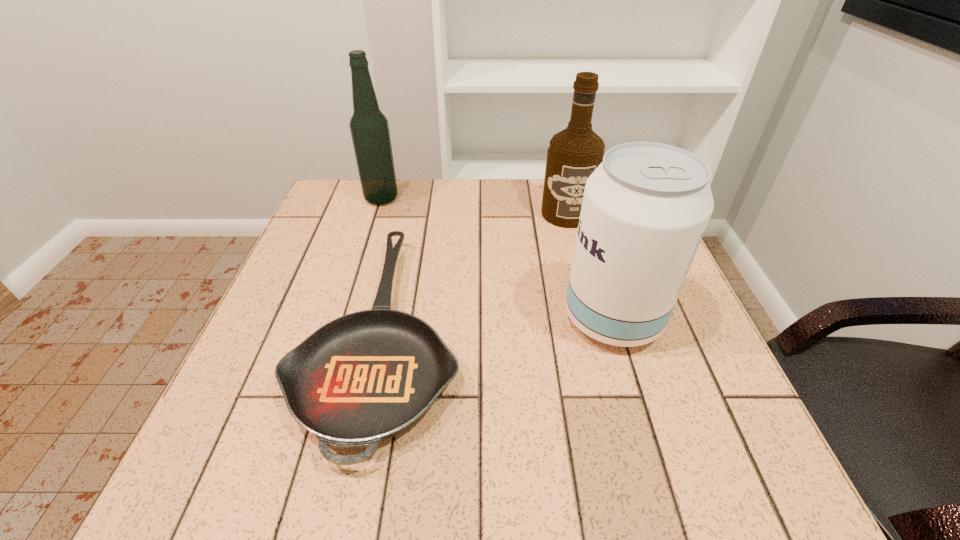
At what (x,y) coordinates should I click in order to perform the action: click on free spot between the leftmost alcohol and the frying pan. Please return your answer as a coordinate pair (x, y). The image size is (960, 540). Looking at the image, I should click on (382, 266).

Choose which object is the second nearest neighbor to the nearest alcohol. Please provide its 2D coordinates. Your answer should be formatted as a tuple, i.e. [(x, y)], where the tuple contains the x and y coordinates of a point satisfying the conditions above.

[(574, 153)]

Select which object appears as the second closest to the shortest object. Please provide its 2D coordinates. Your answer should be formatted as a tuple, i.e. [(x, y)], where the tuple contains the x and y coordinates of a point satisfying the conditions above.

[(645, 208)]

Select which alcohol appears as the closest to the leftmost alcohol. Please provide its 2D coordinates. Your answer should be formatted as a tuple, i.e. [(x, y)], where the tuple contains the x and y coordinates of a point satisfying the conditions above.

[(574, 153)]

Identify which alcohol is located as the second nearest to the nearest alcohol. Please provide its 2D coordinates. Your answer should be formatted as a tuple, i.e. [(x, y)], where the tuple contains the x and y coordinates of a point satisfying the conditions above.

[(369, 127)]